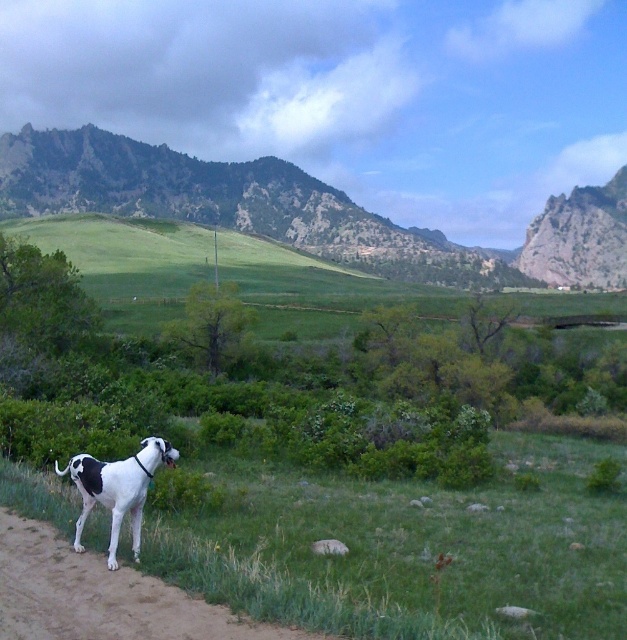
You are a hiker standing on the dirt path where the large dog is positioned. You want to reach the rugged brown mountain at upper left. Considering the mountain is 178.56 meters away from your current position, do you think you can climb it in 20 minutes if you walk at a moderate pace of 5 km per hour?

The rugged brown mountain at upper left is 178.56 meters away from the viewer. Walking at a moderate pace of 5 km per hour, you can cover 5000 meters per hour, which is 83.33 meters per minute. In 20 minutes, you would cover 1,666.6 meters. Since the distance to the mountain is only 178.56 meters, you can easily reach it in less than 3 minutes. However, climbing a mountain typically involves elevation gain and terrain difficulty, which aren answer does not account for. The question only asks about distance,

You are standing on the dirt path and looking towards the mountains. Which object is higher in the scene, the rugged brown mountain at upper left or the brown dirt track at lower left?

The rugged brown mountain at upper left is located above the brown dirt track at lower left, so the rugged brown mountain at upper left is higher in the scene.

You are standing at the point marked by the coordinates point (303, 211) in the image. What is the most prominent feature you can see in the direction you are facing?

The point (303, 211) indicates rugged brown mountain at upper left, so the most prominent feature you can see in that direction is the rugged brown mountain at upper left.